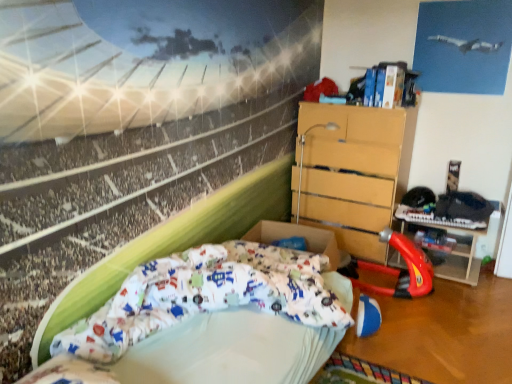
This screenshot has height=384, width=512. Describe the element at coordinates (401, 269) in the screenshot. I see `red plastic toy car at center right` at that location.

What do you see at coordinates (224, 347) in the screenshot? Image resolution: width=512 pixels, height=384 pixels. I see `white fabric bed at lower left` at bounding box center [224, 347].

In order to face white fabric bed at lower left, should I rotate leftwards or rightwards?

It's best to rotate left around 1.722 degrees.

The width and height of the screenshot is (512, 384). I want to click on wooden chest of drawers at center-right, so click(x=352, y=173).

What do you see at coordinates (452, 249) in the screenshot? This screenshot has height=384, width=512. I see `rubberized plastic toy at lower right` at bounding box center [452, 249].

What are the coordinates of `red plastic toy car at center right` in the screenshot? It's located at (401, 269).

From a real-world perspective, is wooden chest of drawers at center-right positioned under red plastic toy car at center right based on gravity?

Actually, wooden chest of drawers at center-right is physically above red plastic toy car at center right in the real world.

Considering the positions of point (401, 136) and point (411, 277), is point (401, 136) closer or farther from the camera than point (411, 277)?

Point (401, 136).

Between wooden chest of drawers at center-right and red plastic toy car at center right, which one has less height?

With less height is red plastic toy car at center right.

Considering the positions of objects wooden chest of drawers at center-right and red plastic toy car at center right in the image provided, who is behind, wooden chest of drawers at center-right or red plastic toy car at center right?

wooden chest of drawers at center-right is further away from the camera.

Considering the relative sizes of white fabric bed at lower left and rubberized plastic toy at lower right in the image provided, is white fabric bed at lower left shorter than rubberized plastic toy at lower right?

Correct, white fabric bed at lower left is not as tall as rubberized plastic toy at lower right.

Is white fabric bed at lower left inside the boundaries of rubberized plastic toy at lower right, or outside?

white fabric bed at lower left cannot be found inside rubberized plastic toy at lower right.

Between white fabric bed at lower left and rubberized plastic toy at lower right, which one has larger size?

white fabric bed at lower left is bigger.

Is wooden chest of drawers at center-right wider or thinner than rubberized plastic toy at lower right?

In the image, wooden chest of drawers at center-right appears to be wider than rubberized plastic toy at lower right.

Are wooden chest of drawers at center-right and rubberized plastic toy at lower right beside each other?

wooden chest of drawers at center-right and rubberized plastic toy at lower right are clearly separated.

Who is shorter, wooden chest of drawers at center-right or rubberized plastic toy at lower right?

With less height is rubberized plastic toy at lower right.

At what (x,y) coordinates should I click in order to perform the action: click on bed on the left of red plastic toy car at center right. Please return your answer as a coordinate pair (x, y). This screenshot has height=384, width=512. Looking at the image, I should click on (224, 347).

Does white fabric bed at lower left have a larger size compared to red plastic toy car at center right?

Yes.

From a real-world perspective, which object rests below the other?

red plastic toy car at center right, from a real-world perspective.

Does white fabric bed at lower left contain red plastic toy car at center right?

Actually, red plastic toy car at center right is outside white fabric bed at lower left.

Can we say rubberized plastic toy at lower right lies outside red plastic toy car at center right?

rubberized plastic toy at lower right lies outside red plastic toy car at center right's area.

Does rubberized plastic toy at lower right have a lesser height compared to red plastic toy car at center right?

Yes, rubberized plastic toy at lower right is shorter than red plastic toy car at center right.

Looking at their sizes, would you say rubberized plastic toy at lower right is wider or thinner than red plastic toy car at center right?

rubberized plastic toy at lower right is thinner than red plastic toy car at center right.

Is point (463, 264) positioned in front of point (364, 268)?

Yes, it is.

Which object is closer to the camera taking this photo, rubberized plastic toy at lower right or wooden chest of drawers at center-right?

wooden chest of drawers at center-right is closer to the camera.

Based on their positions, is rubberized plastic toy at lower right located to the left or right of wooden chest of drawers at center-right?

From the image, it's evident that rubberized plastic toy at lower right is to the right of wooden chest of drawers at center-right.

Looking at this image, considering the sizes of rubberized plastic toy at lower right and wooden chest of drawers at center-right in the image, is rubberized plastic toy at lower right wider or thinner than wooden chest of drawers at center-right?

In the image, rubberized plastic toy at lower right appears to be more narrow than wooden chest of drawers at center-right.

Find the location of `chest of drawers in front of the rubberized plastic toy at lower right`. chest of drawers in front of the rubberized plastic toy at lower right is located at coordinates (352, 173).

Is wooden chest of drawers at center-right located outside white fabric bed at lower left?

Yes.

Looking at this image, is wooden chest of drawers at center-right positioned with its back to white fabric bed at lower left?

No, wooden chest of drawers at center-right is not facing away from white fabric bed at lower left.

Are wooden chest of drawers at center-right and white fabric bed at lower left far apart?

That's right, there is a large distance between wooden chest of drawers at center-right and white fabric bed at lower left.

From their relative heights in the image, would you say wooden chest of drawers at center-right is taller or shorter than white fabric bed at lower left?

Considering their sizes, wooden chest of drawers at center-right has more height than white fabric bed at lower left.

Locate an element on the screen. This screenshot has height=384, width=512. chest of drawers above the red plastic toy car at center right (from the image's perspective) is located at coordinates (352, 173).

Where is `table below the white fabric bed at lower left (from a real-world perspective)`? The width and height of the screenshot is (512, 384). table below the white fabric bed at lower left (from a real-world perspective) is located at coordinates (452, 249).

Looking at the image, which one is located closer to red plastic toy car at center right, rubberized plastic toy at lower right or white fabric bed at lower left?

rubberized plastic toy at lower right is positioned closer to the anchor red plastic toy car at center right.

In the scene shown: Based on their spatial positions, is wooden chest of drawers at center-right or rubberized plastic toy at lower right further from red plastic toy car at center right?

wooden chest of drawers at center-right is further to red plastic toy car at center right.

From the image, which object appears to be farther from red plastic toy car at center right, white fabric bed at lower left or rubberized plastic toy at lower right?

white fabric bed at lower left.

From the image, which object appears to be nearer to rubberized plastic toy at lower right, red plastic toy car at center right or wooden chest of drawers at center-right?

The object closer to rubberized plastic toy at lower right is red plastic toy car at center right.

From the image, which object appears to be nearer to white fabric bed at lower left, red plastic toy car at center right or wooden chest of drawers at center-right?

The object closer to white fabric bed at lower left is red plastic toy car at center right.

When comparing their distances from white fabric bed at lower left, does rubberized plastic toy at lower right or wooden chest of drawers at center-right seem further?

rubberized plastic toy at lower right.

Looking at the image, which one is located closer to white fabric bed at lower left, rubberized plastic toy at lower right or red plastic toy car at center right?

red plastic toy car at center right is positioned closer to the anchor white fabric bed at lower left.

Which object lies further to the anchor point wooden chest of drawers at center-right, white fabric bed at lower left or rubberized plastic toy at lower right?

white fabric bed at lower left.

You are a GUI agent. You are given a task and a screenshot of the screen. Output one action in this format:
    pyautogui.click(x=<x>, y=<y>)
    Task: Click on the sport equipment between white fabric bed at lower left and wooden chest of drawers at center-right along the z-axis
    
    Given the screenshot: What is the action you would take?
    pyautogui.click(x=401, y=269)

Find the location of a particular element. This screenshot has width=512, height=384. sport equipment between white fabric bed at lower left and rubberized plastic toy at lower right from front to back is located at coordinates (401, 269).

This screenshot has width=512, height=384. Find the location of `the chest of drawers located between white fabric bed at lower left and rubberized plastic toy at lower right in the depth direction`. the chest of drawers located between white fabric bed at lower left and rubberized plastic toy at lower right in the depth direction is located at coordinates (352, 173).

Where is `sport equipment located between wooden chest of drawers at center-right and rubberized plastic toy at lower right in the left-right direction`? This screenshot has height=384, width=512. sport equipment located between wooden chest of drawers at center-right and rubberized plastic toy at lower right in the left-right direction is located at coordinates (401, 269).